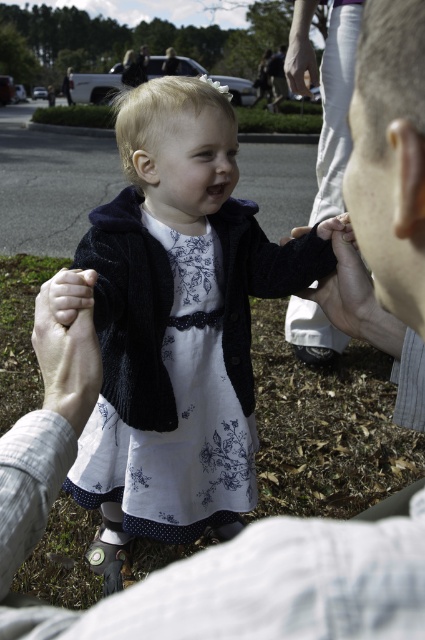
You are a photographer at the event and want to capture a closeup of the floral dress at center without the smooth skin hand at center blocking it. Based on their positions, can you adjust your camera angle to achieve this?

The floral dress at center is below the smooth skin hand at center, so you can lower your camera angle to capture the floral dress at center without the hand blocking it.

What is located at the coordinates point (67, 358) in the image?

The point at coordinates (67, 358) corresponds to white smooth skin at center.

You are a photographer trying to capture the child in the scene. You notice the smooth skin hand at center and the white smooth skin at center. Which object is positioned to the right of the other?

The smooth skin hand at center is to the right of white smooth skin at center.